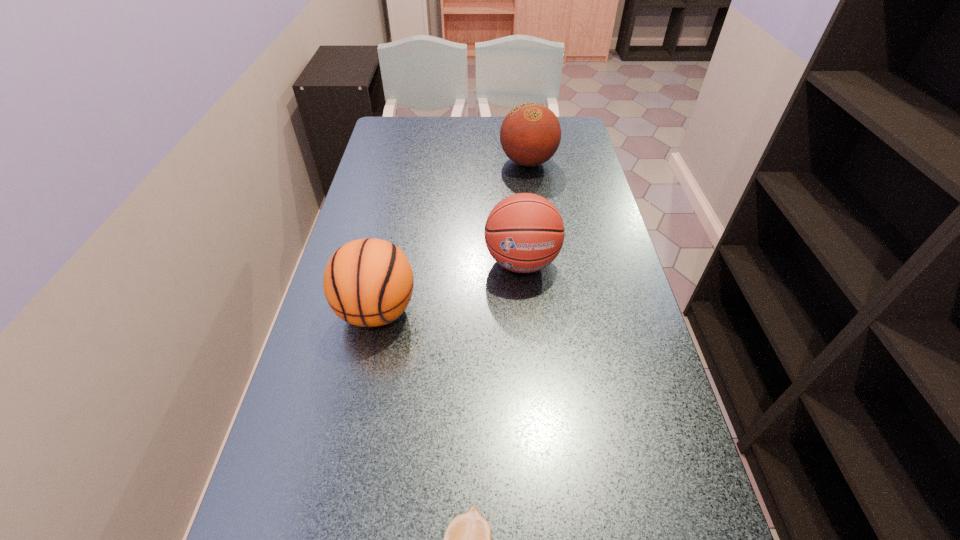
This screenshot has height=540, width=960. Identify the location of the farthest basketball. (530, 134).

The image size is (960, 540). What are the coordinates of `the leftmost object` in the screenshot? It's located at (369, 282).

At what (x,y) coordinates should I click in order to perform the action: click on vacant space located 0.180m on the back of the farthest object. Please return your answer as a coordinate pair (x, y). This screenshot has height=540, width=960. Looking at the image, I should click on [522, 123].

The height and width of the screenshot is (540, 960). What are the coordinates of `free spot located on the back of the leftmost object` in the screenshot? It's located at (389, 252).

This screenshot has width=960, height=540. I want to click on object at the far edge, so [x=530, y=134].

This screenshot has height=540, width=960. In order to click on object located in the left edge section of the desktop in this screenshot , I will do `click(369, 282)`.

The height and width of the screenshot is (540, 960). I want to click on object that is at the right edge, so click(x=530, y=134).

Find the location of a particular element. This screenshot has height=540, width=960. object located at the far right corner is located at coordinates (530, 134).

You are a GUI agent. You are given a task and a screenshot of the screen. Output one action in this format:
    pyautogui.click(x=<x>, y=<y>)
    Task: Click on the free spot at the far edge of the desktop
    
    Given the screenshot: What is the action you would take?
    pyautogui.click(x=452, y=126)

The image size is (960, 540). Identify the location of vacant space at the left edge of the desktop. (272, 467).